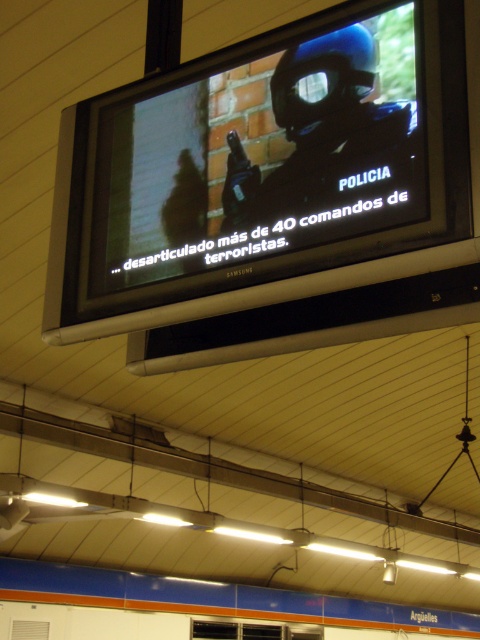
You are a maintenance worker in the station and need to reach the point at coordinates (374, 29) on the television screen to clean it. The ladder you have can extend up to 2 meters. Will the ladder be sufficient to reach that point?

The point at coordinates (374, 29) is 2.19 meters away from the camera, so the ladder that extends up to 2 meters will not be sufficient to reach it.

You are a passenger in the subway station and notice the matte black screen at upper center and the matte black helmet at center. Which object is positioned to the right side from your perspective?

The matte black helmet at center is positioned to the right side from your perspective because the matte black screen at upper center is to the left of it.

You are a security analyst reviewing a surveillance feed. You notice two objects of interest on the screen. The first is the matte black screen at upper center and the second is the matte black helmet at center. Which object is bigger in size?

The matte black screen at upper center is larger in size than the matte black helmet at center.